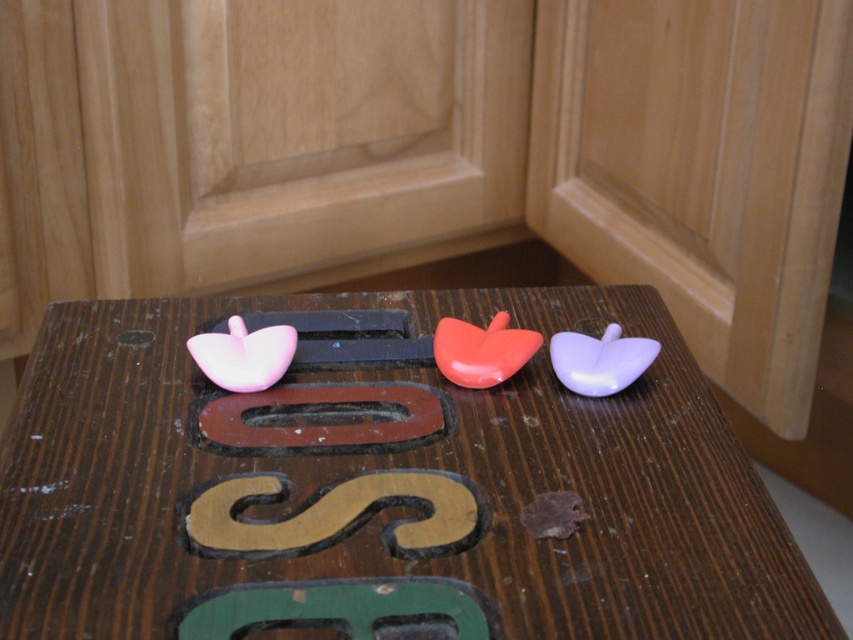
Question: Which point appears farthest from the camera in this image?

Choices:
 (A) (285, 620)
 (B) (413, 372)
 (C) (306, 422)
 (D) (445, 540)

Answer: (B)

Question: Does green matte letter at center appear under brown matte letter o at center?

Choices:
 (A) no
 (B) yes

Answer: (B)

Question: Based on their relative distances, which object is farther from the green matte letter at center?

Choices:
 (A) brown matte letter o at center
 (B) brown matte letter s at center
 (C) wooden table at center

Answer: (C)

Question: Which of these objects is positioned closest to the green matte letter at center?

Choices:
 (A) brown matte letter o at center
 (B) brown matte letter s at center
 (C) wooden table at center

Answer: (B)

Question: Does wooden table at center have a greater width compared to brown matte letter s at center?

Choices:
 (A) no
 (B) yes

Answer: (B)

Question: Can you confirm if brown matte letter s at center is positioned above green matte letter at center?

Choices:
 (A) yes
 (B) no

Answer: (A)